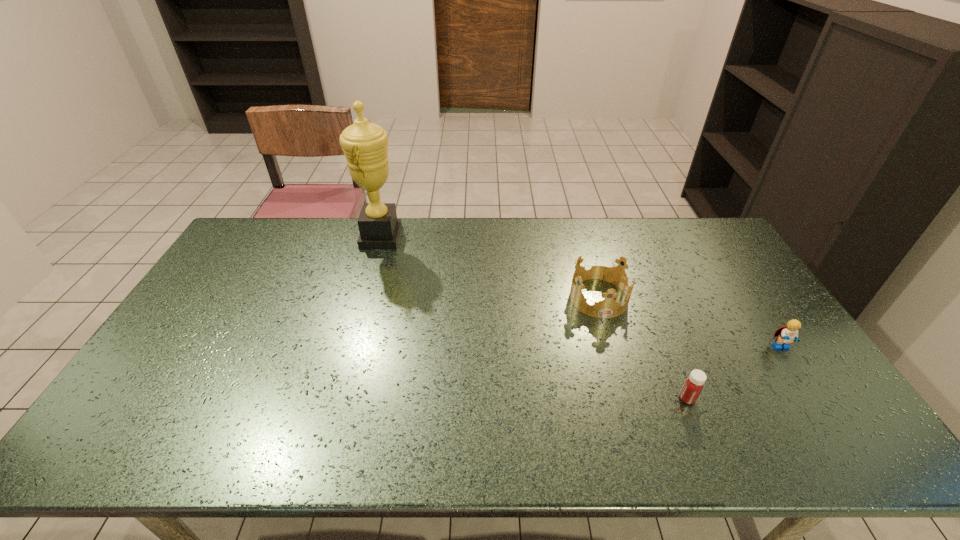
This screenshot has width=960, height=540. I want to click on vacant space located on the front-facing side of the rightmost object, so click(x=829, y=421).

This screenshot has height=540, width=960. In order to click on free location located on the back of the medicine in this screenshot , I will do `click(665, 346)`.

Identify the location of object that is positioned at the far edge. This screenshot has width=960, height=540. (364, 144).

The height and width of the screenshot is (540, 960). Find the location of `object that is at the right edge`. object that is at the right edge is located at coordinates (785, 335).

This screenshot has width=960, height=540. What are the coordinates of `vacant space at the far edge` in the screenshot? It's located at (671, 228).

The height and width of the screenshot is (540, 960). In order to click on vacant space at the left edge of the desktop in this screenshot , I will do `click(178, 348)`.

The height and width of the screenshot is (540, 960). Identify the location of free space at the far right corner. (696, 248).

Find the location of a particular element. The image size is (960, 540). unoccupied position between the third object from left to right and the leftmost object is located at coordinates (534, 318).

At what (x,y) coordinates should I click in order to perform the action: click on empty location between the trophy cup and the second farthest object. Please return your answer as a coordinate pair (x, y). Looking at the image, I should click on (490, 267).

Locate an element on the screen. Image resolution: width=960 pixels, height=540 pixels. vacant region between the nearest object and the third nearest object is located at coordinates (643, 348).